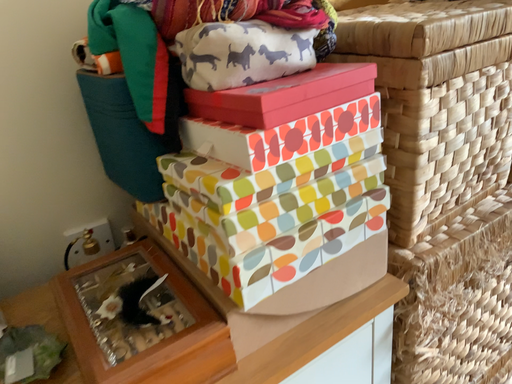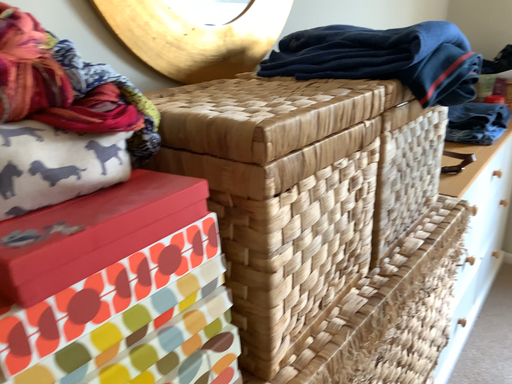
Question: How did the camera likely rotate when shooting the video?

Choices:
 (A) rotated left
 (B) rotated right

Answer: (B)